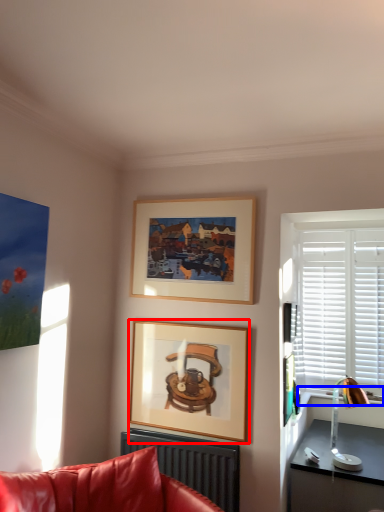
Question: Which object appears closest to the camera in this image, picture frame (highlighted by a red box) or window sill (highlighted by a blue box)?

Choices:
 (A) picture frame
 (B) window sill

Answer: (A)